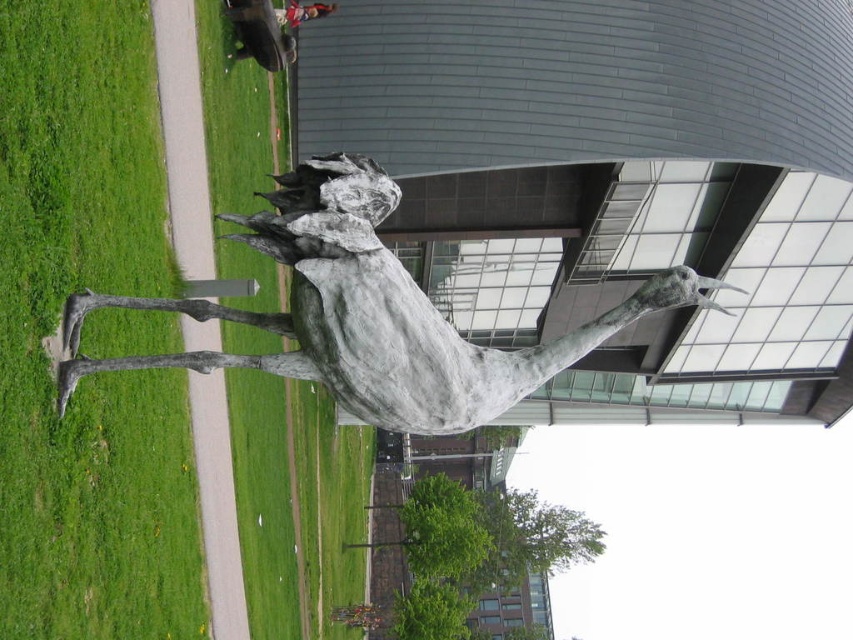
Question: Does green grass at left appear over bronze horse at center?

Choices:
 (A) no
 (B) yes

Answer: (A)

Question: Does green grass at left have a smaller size compared to red shirt at upper center?

Choices:
 (A) yes
 (B) no

Answer: (B)

Question: Among these points, which one is farthest from the camera?

Choices:
 (A) (90, 124)
 (B) (296, 8)
 (C) (393, 296)

Answer: (B)

Question: In this image, where is green grass at left located relative to red shirt at upper center?

Choices:
 (A) left
 (B) right

Answer: (A)

Question: Among these points, which one is nearest to the camera?

Choices:
 (A) (12, 381)
 (B) (283, 22)

Answer: (A)

Question: Which object is farther from the camera taking this photo?

Choices:
 (A) red shirt at upper center
 (B) green grass at left
 (C) bronze horse at center

Answer: (A)